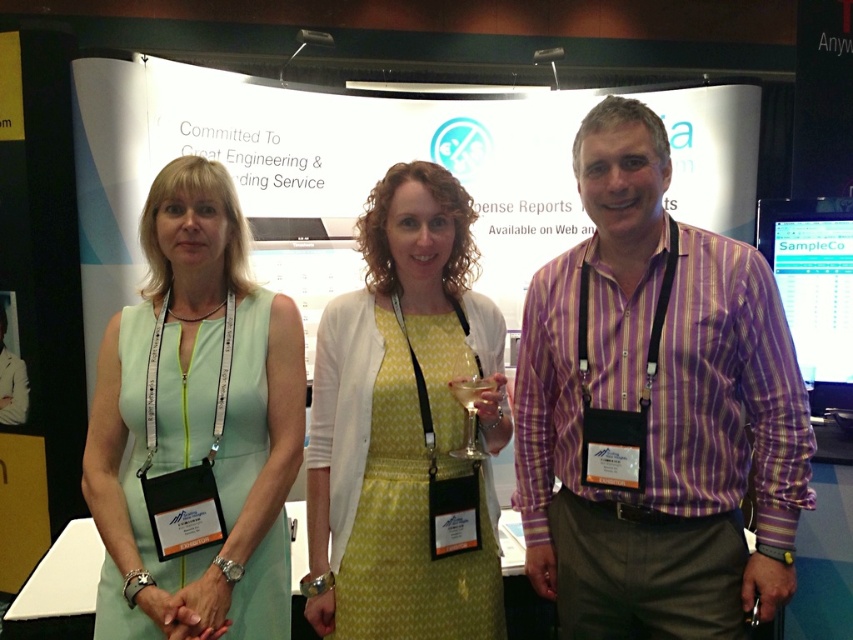
Is light green fabric dress at left closer to camera compared to clear plastic wine glass at center?

Yes, light green fabric dress at left is in front of clear plastic wine glass at center.

Between light green fabric dress at left and clear plastic wine glass at center, which one has less height?

With less height is clear plastic wine glass at center.

The height and width of the screenshot is (640, 853). I want to click on light green fabric dress at left, so click(196, 428).

Locate an element on the screen. light green fabric dress at left is located at coordinates (196, 428).

From the picture: Does purple striped shirt at center have a smaller size compared to clear plastic wine glass at center?

No, purple striped shirt at center is not smaller than clear plastic wine glass at center.

Who is positioned more to the left, purple striped shirt at center or clear plastic wine glass at center?

Positioned to the left is clear plastic wine glass at center.

Describe the element at coordinates (656, 410) in the screenshot. I see `purple striped shirt at center` at that location.

The width and height of the screenshot is (853, 640). In order to click on purple striped shirt at center in this screenshot , I will do `click(656, 410)`.

Between point (419, 205) and point (465, 429), which one is positioned behind?

Positioned behind is point (419, 205).

You are a GUI agent. You are given a task and a screenshot of the screen. Output one action in this format:
    pyautogui.click(x=<x>, y=<y>)
    Task: Click on the yellow dotted dress at center
    The image size is (853, 640).
    Given the screenshot: What is the action you would take?
    pyautogui.click(x=402, y=424)